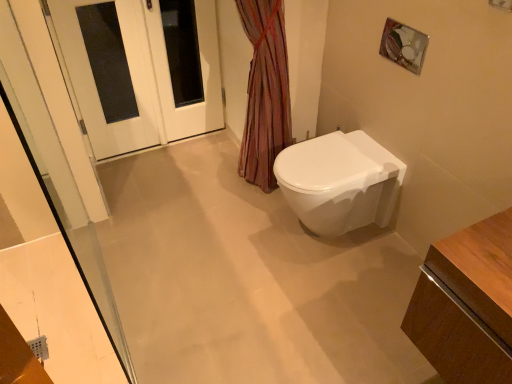
Question: Is white glossy door at upper left positioned in front of white glossy toilet at center-right?

Choices:
 (A) yes
 (B) no

Answer: (B)

Question: Are white glossy door at upper left and white glossy toilet at center-right located far from each other?

Choices:
 (A) no
 (B) yes

Answer: (B)

Question: Considering the relative sizes of white glossy door at upper left and white glossy toilet at center-right in the image provided, is white glossy door at upper left thinner than white glossy toilet at center-right?

Choices:
 (A) yes
 (B) no

Answer: (A)

Question: Does white glossy door at upper left have a greater height compared to white glossy toilet at center-right?

Choices:
 (A) no
 (B) yes

Answer: (B)

Question: Is white glossy door at upper left further to camera compared to white glossy toilet at center-right?

Choices:
 (A) no
 (B) yes

Answer: (B)

Question: Is white glossy door at upper left shorter than white glossy toilet at center-right?

Choices:
 (A) no
 (B) yes

Answer: (A)

Question: From a real-world perspective, is white glossy toilet at center-right physically above white glossy door at upper left?

Choices:
 (A) yes
 (B) no

Answer: (B)

Question: Could you tell me if white glossy toilet at center-right is turned towards white glossy door at upper left?

Choices:
 (A) no
 (B) yes

Answer: (A)

Question: Can you confirm if white glossy toilet at center-right is bigger than white glossy door at upper left?

Choices:
 (A) no
 (B) yes

Answer: (B)

Question: From the image's perspective, is white glossy toilet at center-right above white glossy door at upper left?

Choices:
 (A) yes
 (B) no

Answer: (B)

Question: Is white glossy toilet at center-right to the left of white glossy door at upper left from the viewer's perspective?

Choices:
 (A) no
 (B) yes

Answer: (A)

Question: Is white glossy toilet at center-right completely or partially outside of white glossy door at upper left?

Choices:
 (A) yes
 (B) no

Answer: (A)

Question: From the image's perspective, is white glossy door at upper left beneath white glossy door at upper left?

Choices:
 (A) yes
 (B) no

Answer: (A)